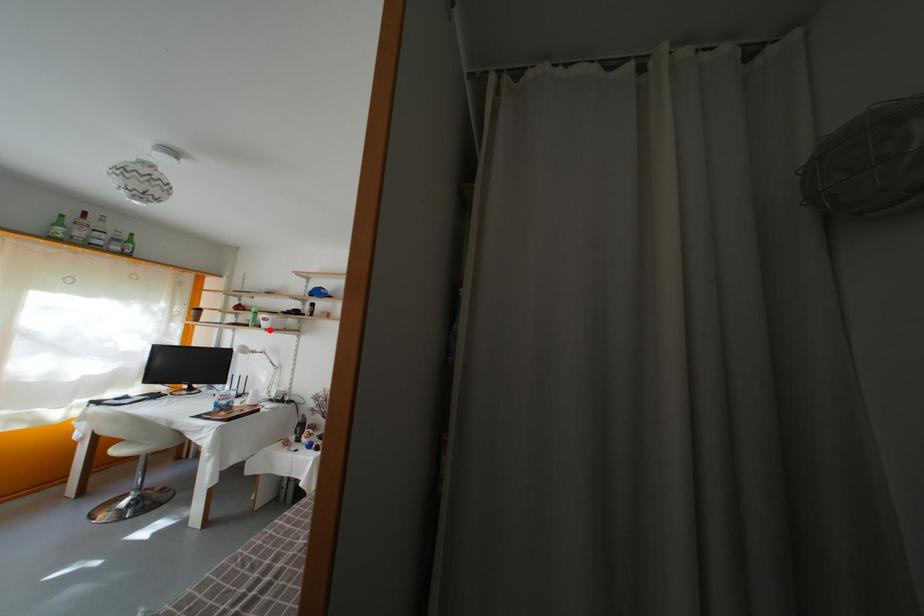
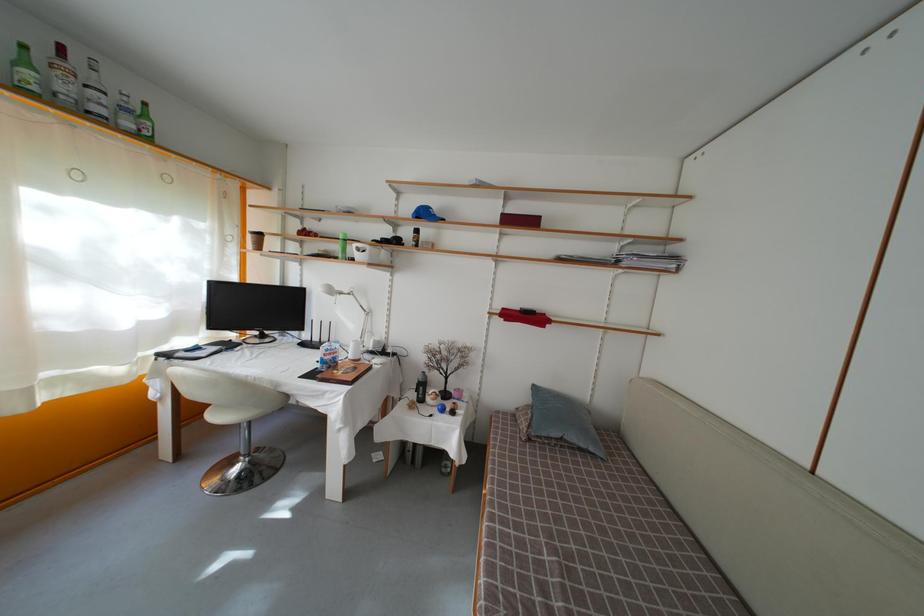
Locate, in the second image, the point that corresponds to the highlighted location in the first image.

(363, 262)